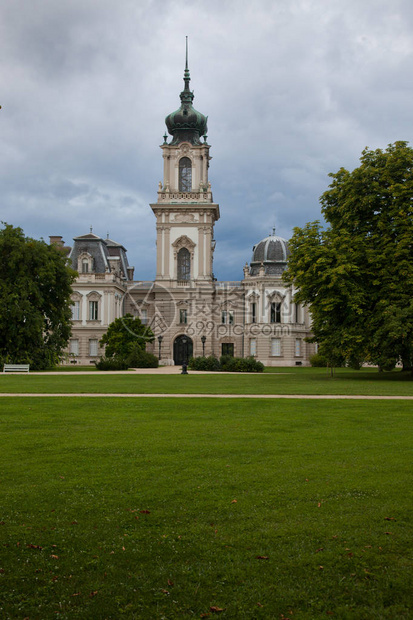
Image resolution: width=413 pixels, height=620 pixels. Find the location of `main entrance`. main entrance is located at coordinates (181, 350).